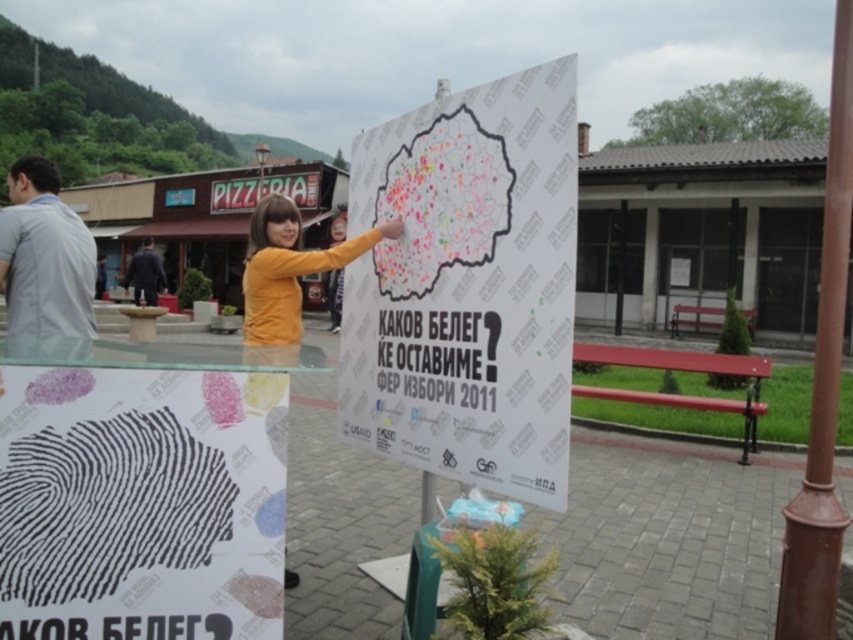
Is gray fabric shirt at left above dark blue coat at left?

No.

Can you confirm if gray fabric shirt at left is smaller than dark blue coat at left?

Indeed, gray fabric shirt at left has a smaller size compared to dark blue coat at left.

Does point (51, 186) come farther from viewer compared to point (158, 288)?

That is False.

You are a GUI agent. You are given a task and a screenshot of the screen. Output one action in this format:
    pyautogui.click(x=<x>, y=<y>)
    Task: Click on the gray fabric shirt at left
    
    Given the screenshot: What is the action you would take?
    pyautogui.click(x=45, y=266)

Does point (457, 164) come closer to viewer compared to point (135, 269)?

Yes, point (457, 164) is closer to viewer.

Who is more forward, (418, 232) or (138, 272)?

Point (418, 232) is in front.

The image size is (853, 640). What are the coordinates of `colored paper map at center` in the screenshot? It's located at (442, 204).

Is point (119, 384) closer to viewer compared to point (294, 300)?

Yes, it is.

Is black fingerprint at center positioned behind yellow matte shirt at center?

That is False.

This screenshot has height=640, width=853. Describe the element at coordinates (141, 502) in the screenshot. I see `black fingerprint at center` at that location.

This screenshot has height=640, width=853. I want to click on black fingerprint at center, so click(141, 502).